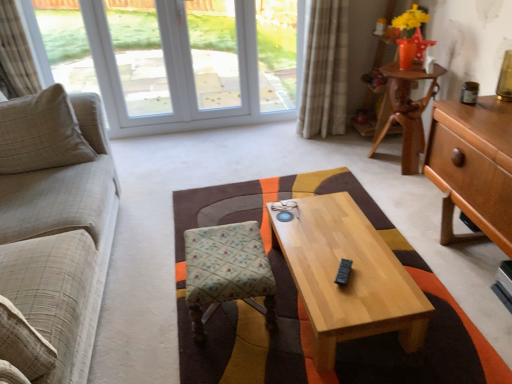
Find the location of a particular element. Image resolution: width=512 pixels, height=384 pixels. free space to the left of plaid fabric curtain at upper right, the 2th curtain in the left-to-right sequence is located at coordinates (282, 138).